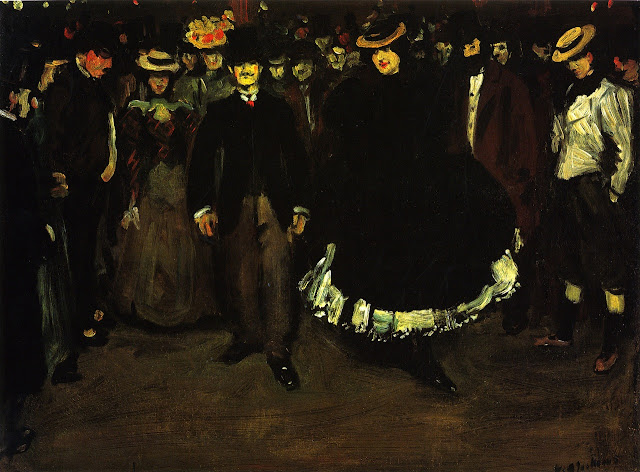
Where is `empty floor center of painting`? empty floor center of painting is located at coordinates (326, 422).